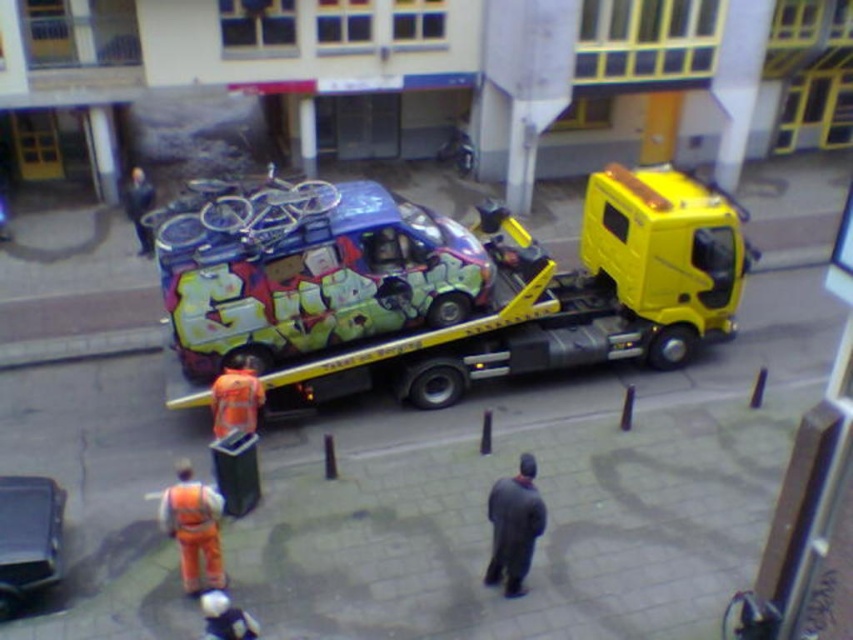
You are standing at the point labeled as point (547, 300). What object are you currently standing on?

You are standing on the yellow metallic tow truck at center.

You are standing in front of the tow truck and van scene. There are two points marked on the image. Which point, point [51,577] or point [158,508], is closer to you?

→ Point [51,577] is closer to the viewer than point [158,508].